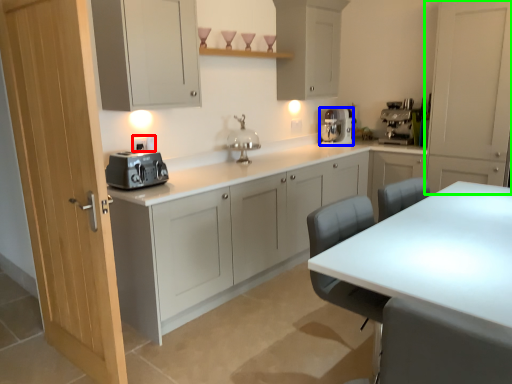
Question: Based on their relative distances, which object is nearer to electric outlet (highlighted by a red box)? Choose from kitchen appliance (highlighted by a blue box) and cabinetry (highlighted by a green box).

Choices:
 (A) kitchen appliance
 (B) cabinetry

Answer: (A)